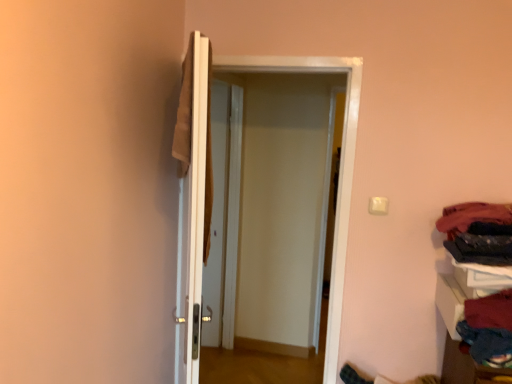
Question: Considering the relative positions of white glossy door at center, which is counted as the second door, starting from the left, and velvet red sweater at lower right, which is the 1th clothing in bottom-to-top order, in the image provided, is white glossy door at center, which is counted as the second door, starting from the left, to the right of velvet red sweater at lower right, which is the 1th clothing in bottom-to-top order, from the viewer's perspective?

Choices:
 (A) yes
 (B) no

Answer: (B)

Question: Does white glossy door at center, which is counted as the second door, starting from the left, have a greater height compared to velvet red sweater at lower right, which is the 3th clothing in top-to-bottom order?

Choices:
 (A) yes
 (B) no

Answer: (A)

Question: Does white glossy door at center, which is counted as the second door, starting from the left, appear on the left side of velvet red sweater at lower right, which is the 1th clothing in bottom-to-top order?

Choices:
 (A) no
 (B) yes

Answer: (B)

Question: Does white glossy door at center, which is counted as the second door, starting from the left, come in front of velvet red sweater at lower right, which is the 1th clothing in bottom-to-top order?

Choices:
 (A) yes
 (B) no

Answer: (B)

Question: Does white glossy door at center, which is counted as the second door, starting from the left, have a lesser width compared to velvet red sweater at lower right, which is the 1th clothing in bottom-to-top order?

Choices:
 (A) yes
 (B) no

Answer: (A)

Question: Would you say black fabric at right, positioned as the 2th clothing in bottom-to-top order, is to the left or to the right of velvet red sweater at lower right, which is the 1th clothing in bottom-to-top order, in the picture?

Choices:
 (A) left
 (B) right

Answer: (B)

Question: Based on their sizes in the image, would you say black fabric at right, arranged as the second clothing when viewed from the top, is bigger or smaller than velvet red sweater at lower right, which is the 1th clothing in bottom-to-top order?

Choices:
 (A) small
 (B) big

Answer: (A)

Question: From the image's perspective, is black fabric at right, positioned as the 2th clothing in bottom-to-top order, positioned above or below velvet red sweater at lower right, which is the 3th clothing in top-to-bottom order?

Choices:
 (A) above
 (B) below

Answer: (A)

Question: Considering the positions of black fabric at right, positioned as the 2th clothing in bottom-to-top order, and velvet red sweater at lower right, which is the 3th clothing in top-to-bottom order, in the image, is black fabric at right, positioned as the 2th clothing in bottom-to-top order, wider or thinner than velvet red sweater at lower right, which is the 3th clothing in top-to-bottom order,?

Choices:
 (A) thin
 (B) wide

Answer: (A)

Question: Based on their sizes in the image, would you say velvet red sweater at lower right, which is the 3th clothing in top-to-bottom order, is bigger or smaller than white glossy door at center, which is counted as the second door, starting from the left?

Choices:
 (A) big
 (B) small

Answer: (B)

Question: From the image's perspective, relative to white glossy door at center, which is counted as the second door, starting from the left, is velvet red sweater at lower right, which is the 1th clothing in bottom-to-top order, above or below?

Choices:
 (A) below
 (B) above

Answer: (A)

Question: Is velvet red sweater at lower right, which is the 1th clothing in bottom-to-top order, to the left or to the right of white glossy door at center, which is counted as the first door, starting from the right, in the image?

Choices:
 (A) right
 (B) left

Answer: (A)

Question: From their relative heights in the image, would you say velvet red sweater at lower right, which is the 1th clothing in bottom-to-top order, is taller or shorter than white glossy door at center, which is counted as the first door, starting from the right?

Choices:
 (A) short
 (B) tall

Answer: (A)

Question: From a real-world perspective, is black fabric at right, arranged as the second clothing when viewed from the top, physically located above or below white glossy door at center, which is the second door from right to left?

Choices:
 (A) above
 (B) below

Answer: (A)

Question: From their relative heights in the image, would you say black fabric at right, positioned as the 2th clothing in bottom-to-top order, is taller or shorter than white glossy door at center, which is the second door from right to left?

Choices:
 (A) short
 (B) tall

Answer: (A)